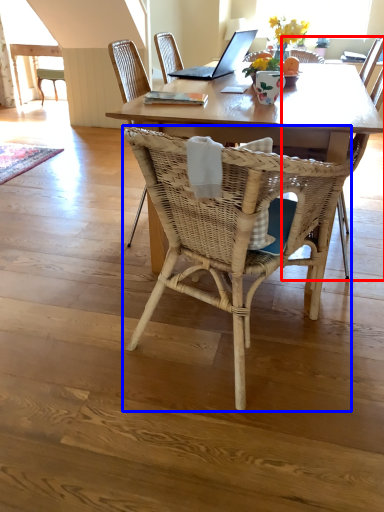
Question: Among these objects, which one is nearest to the camera, armchair (highlighted by a red box) or chair (highlighted by a blue box)?

Choices:
 (A) armchair
 (B) chair

Answer: (B)